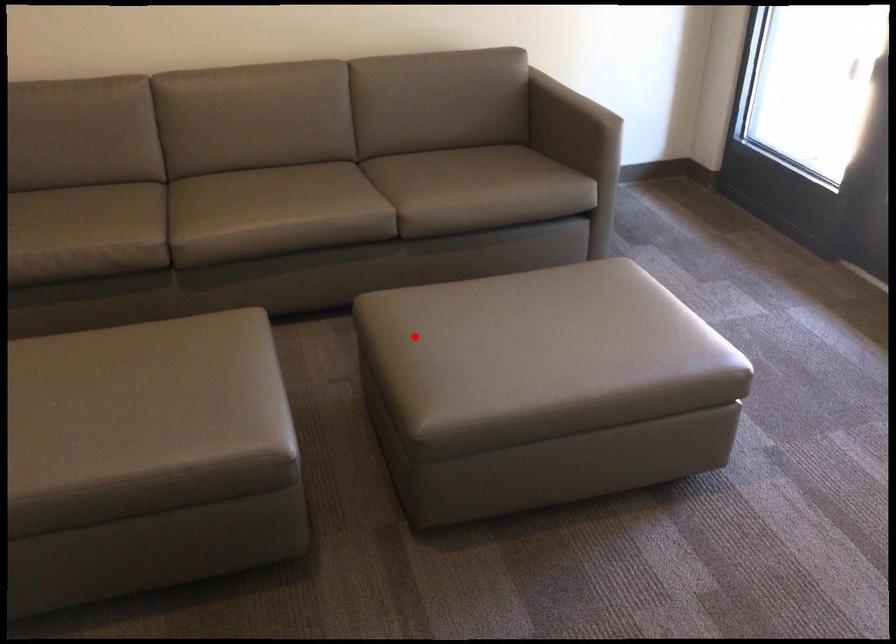
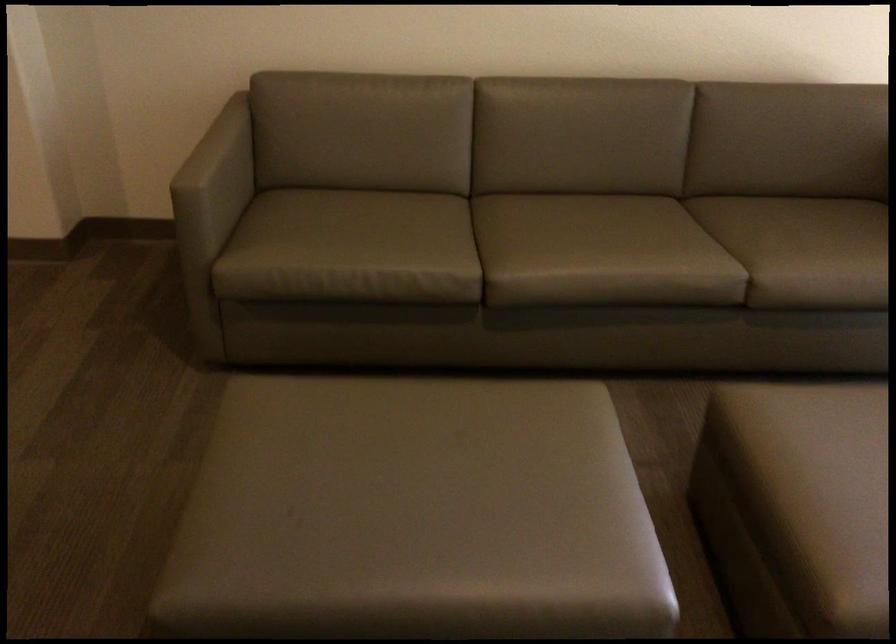
Where in the second image is the point corresponding to the highlighted location from the first image?

(814, 464)